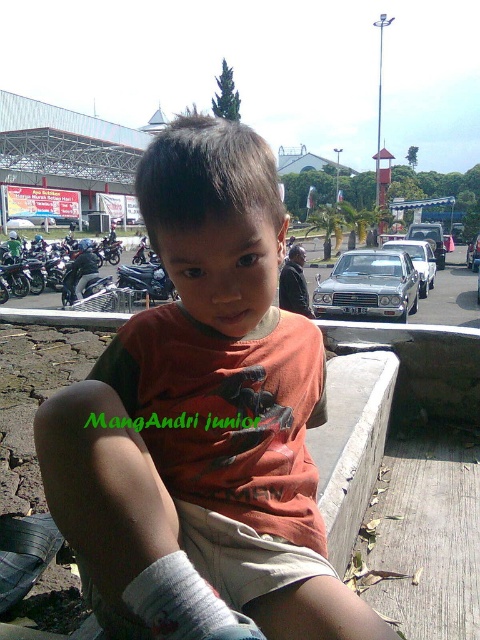
Question: Is silver metallic sedan at center thinner than shiny silver sedan at center?

Choices:
 (A) no
 (B) yes

Answer: (B)

Question: Which is farther from the brown concrete curb at lower center?

Choices:
 (A) shiny silver car at center
 (B) white fabric sock at lower left

Answer: (A)

Question: Is brown concrete curb at lower center behind blue metallic motorcycle at left?

Choices:
 (A) yes
 (B) no

Answer: (B)

Question: Which point is closer to the camera?

Choices:
 (A) silver metallic sedan at center
 (B) shiny silver sedan at center
 (C) brown concrete curb at lower center
 (D) orange cotton shirt at center

Answer: (D)

Question: Which point is farther from the camera taking this photo?

Choices:
 (A) (420, 292)
 (B) (435, 224)
 (C) (54, 419)

Answer: (B)

Question: Does white fabric sock at lower left have a greater width compared to shiny silver sedan at center?

Choices:
 (A) no
 (B) yes

Answer: (A)